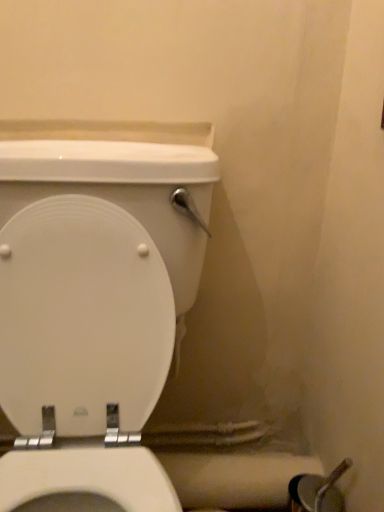
Question: From a real-world perspective, is white matte toilet paper at lower right on top of white glossy toilet at center?

Choices:
 (A) yes
 (B) no

Answer: (B)

Question: Is white matte toilet paper at lower right positioned in front of white glossy toilet at center?

Choices:
 (A) yes
 (B) no

Answer: (B)

Question: From the image's perspective, would you say white matte toilet paper at lower right is shown under white glossy toilet at center?

Choices:
 (A) yes
 (B) no

Answer: (A)

Question: Does white matte toilet paper at lower right have a larger size compared to white glossy toilet at center?

Choices:
 (A) no
 (B) yes

Answer: (A)

Question: Considering the relative positions of white matte toilet paper at lower right and white glossy toilet at center in the image provided, is white matte toilet paper at lower right to the right of white glossy toilet at center from the viewer's perspective?

Choices:
 (A) yes
 (B) no

Answer: (A)

Question: Considering the relative sizes of white matte toilet paper at lower right and white glossy toilet at center in the image provided, is white matte toilet paper at lower right thinner than white glossy toilet at center?

Choices:
 (A) no
 (B) yes

Answer: (B)

Question: Is white glossy toilet at center turned away from white matte toilet paper at lower right?

Choices:
 (A) yes
 (B) no

Answer: (B)

Question: From the image's perspective, is white glossy toilet at center on top of white matte toilet paper at lower right?

Choices:
 (A) no
 (B) yes

Answer: (B)

Question: Are white glossy toilet at center and white matte toilet paper at lower right far apart?

Choices:
 (A) no
 (B) yes

Answer: (A)

Question: Can we say white glossy toilet at center lies outside white matte toilet paper at lower right?

Choices:
 (A) no
 (B) yes

Answer: (B)

Question: Is white glossy toilet at center behind white matte toilet paper at lower right?

Choices:
 (A) yes
 (B) no

Answer: (B)

Question: Is white glossy toilet at center closer to the viewer compared to white matte toilet paper at lower right?

Choices:
 (A) yes
 (B) no

Answer: (A)

Question: Is point (21, 307) closer or farther from the camera than point (251, 483)?

Choices:
 (A) closer
 (B) farther

Answer: (A)